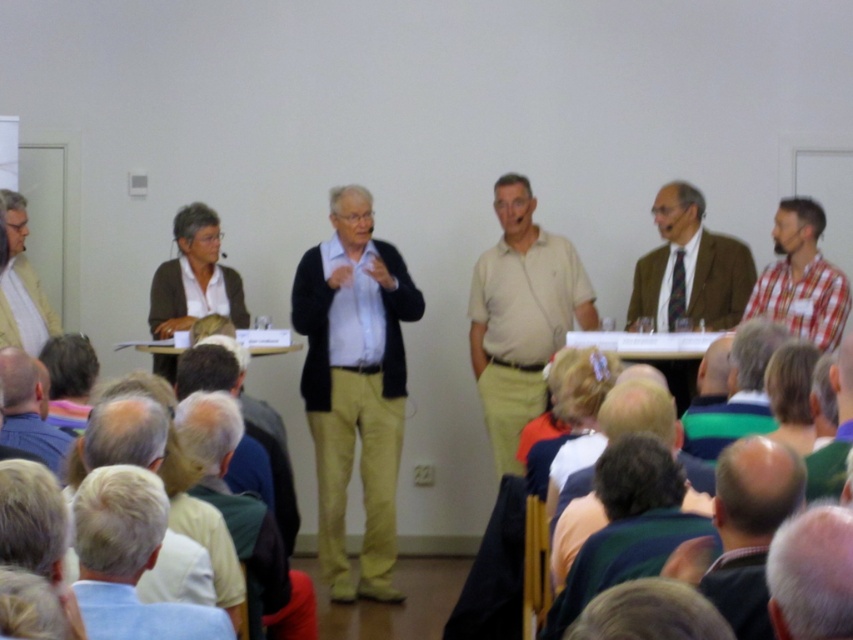
Question: Can you confirm if checkered fabric shirt at right is smaller than light blue shirt at lower left?

Choices:
 (A) no
 (B) yes

Answer: (A)

Question: Which of the following is the closest to the observer?

Choices:
 (A) (4, 208)
 (B) (373, 342)
 (C) (213, 397)

Answer: (C)

Question: From the image, what is the correct spatial relationship of checkered fabric shirt at right in relation to light blue shirt at lower left?

Choices:
 (A) above
 (B) below

Answer: (A)

Question: Where is matte brown suit at center located in relation to fluffy pink fur at lower right in the image?

Choices:
 (A) above
 (B) below

Answer: (A)

Question: Which object is positioned farthest from the light beige pants at center?

Choices:
 (A) light blue shirt at lower left
 (B) white matte hair at lower left
 (C) light beige sweater at left
 (D) matte brown suit at center

Answer: (D)

Question: Which point is farther to the camera?

Choices:
 (A) (810, 221)
 (B) (138, 616)
 (C) (247, 547)
 (D) (701, 244)

Answer: (D)